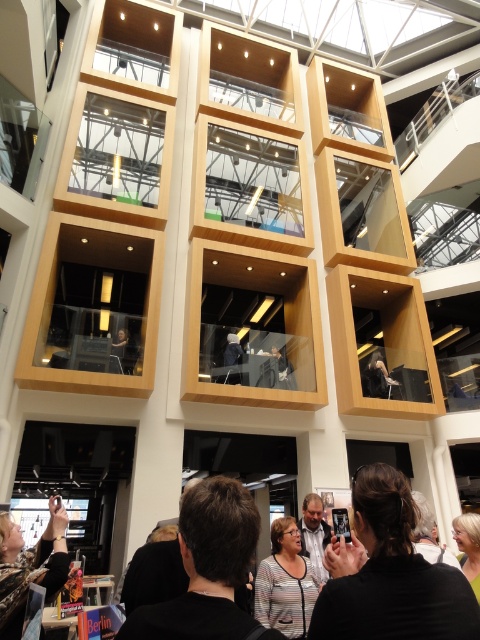
You are a photographer standing in the modern architectural space described. You need to capture a photo that includes both the dark brown hair at center and the black leather jacket at lower left. Which object will appear larger in your photo?

The dark brown hair at center will appear larger in the photo because it has a larger size compared to the black leather jacket at lower left.